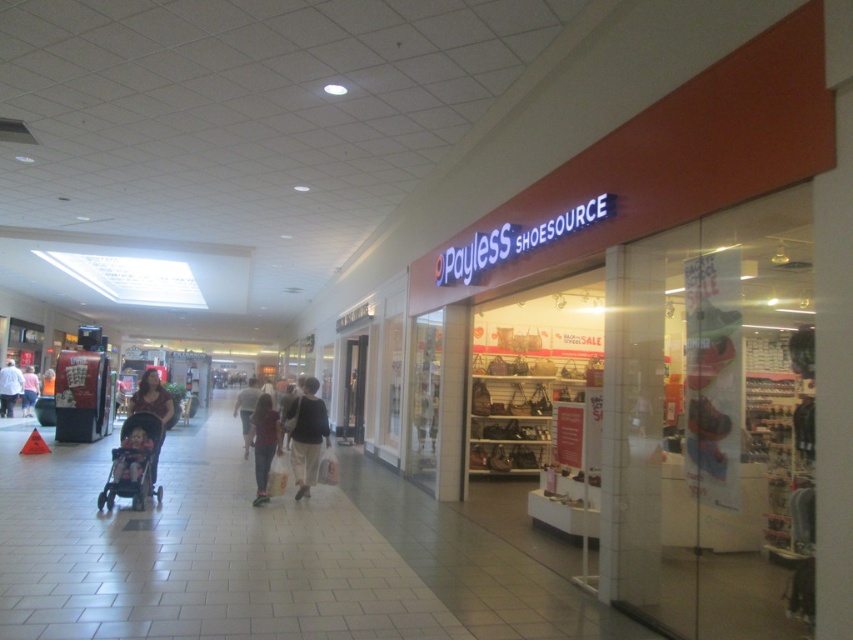
Question: Does dark gray fabric jacket at center appear on the right side of denim pants at center?

Choices:
 (A) yes
 (B) no

Answer: (A)

Question: Among these points, which one is farthest from the camera?

Choices:
 (A) (303, 426)
 (B) (148, 449)
 (C) (247, 410)
 (D) (12, 406)

Answer: (D)

Question: Is matte pink baby carriage at left bigger than white cotton shirt at center?

Choices:
 (A) no
 (B) yes

Answer: (A)

Question: Which point is farther from the camera taking this photo?

Choices:
 (A) (10, 371)
 (B) (277, 440)
 (C) (28, 396)
 (D) (129, 435)

Answer: (C)

Question: Where is denim pants at center located in relation to light brown leather jacket at center in the image?

Choices:
 (A) right
 (B) left

Answer: (A)

Question: Among these objects, which one is nearest to the camera?

Choices:
 (A) matte pink shirt at center
 (B) light brown leather jacket at center
 (C) silver metallic stroller at left

Answer: (C)